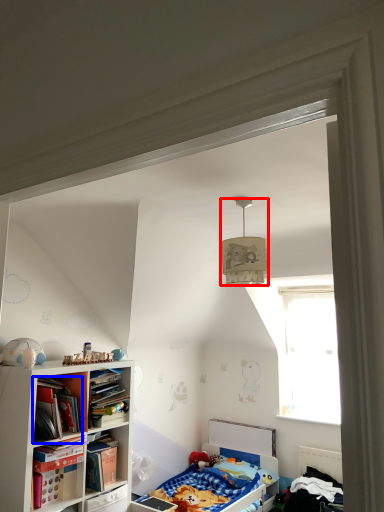
Question: Which point is further to the camera, lamp (highlighted by a red box) or book (highlighted by a blue box)?

Choices:
 (A) lamp
 (B) book

Answer: (B)